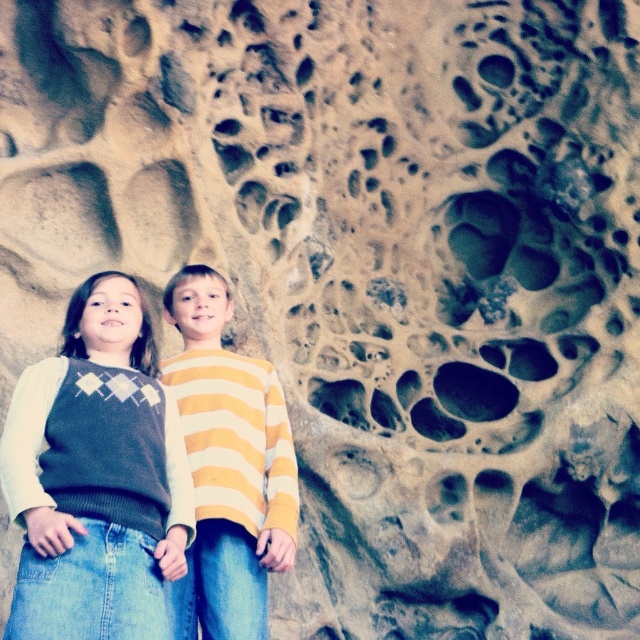
You are a photographer trying to capture the two children in the scene. You notice two specific points marked on the image. The first point is at coordinate point (35, 397) and the second is at point (278, 531). If you want to ensure that both points are clearly visible in your photo, which point should you prioritize keeping in the frame first?

Point (35, 397) should be prioritized because it is in front of point (278, 531), making it more visible in the frame.

You are a photographer trying to capture both the knit sweater at center and the yellow striped sweater at center in a single photo. Since you want both sweaters to be visible, which sweater should you focus on first to ensure the one farther away is still in focus?

The knit sweater at center is below the yellow striped sweater at center, so you should focus on the yellow striped sweater at center first to ensure the one farther away is in focus.